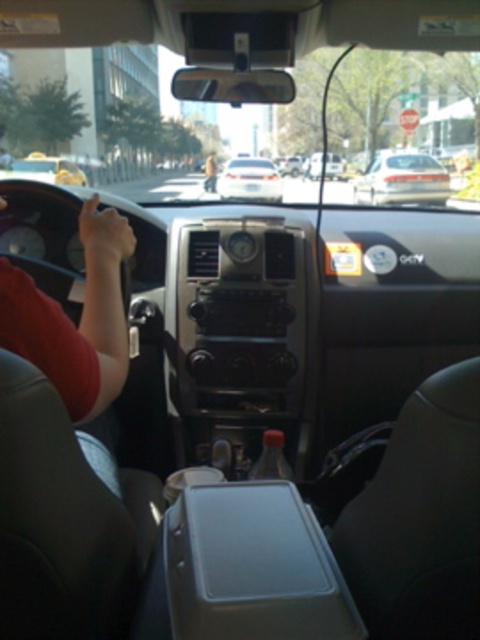
Question: Observing the image, what is the correct spatial positioning of metallic silver car at center in reference to light brown leather jacket at center?

Choices:
 (A) right
 (B) left

Answer: (A)

Question: Where is white matte sedan at center located in relation to white glossy sedan at center in the image?

Choices:
 (A) above
 (B) below

Answer: (A)

Question: Which point appears closest to the camera in this image?

Choices:
 (A) (417, 166)
 (B) (215, 189)
 (C) (237, 180)
 (D) (311, 157)

Answer: (A)

Question: Estimate the real-world distances between objects in this image. Which object is closer to the white matte sedan at center?

Choices:
 (A) metallic silver car at center
 (B) light brown leather jacket at center
 (C) white glossy sedan at center

Answer: (C)

Question: In this image, where is white matte sedan at center located relative to light brown leather jacket at center?

Choices:
 (A) left
 (B) right

Answer: (B)

Question: Which object is closer to the camera taking this photo?

Choices:
 (A) metallic silver car at center
 (B) light brown leather jacket at center
 (C) white glossy sedan at center

Answer: (C)